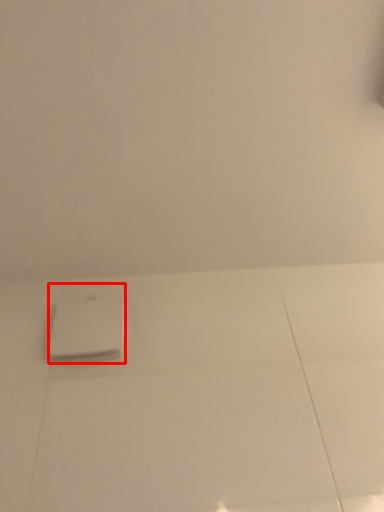
Question: From the image's perspective, what is the correct spatial relationship of home appliance (annotated by the red box) in relation to backdrop?

Choices:
 (A) above
 (B) below

Answer: (B)